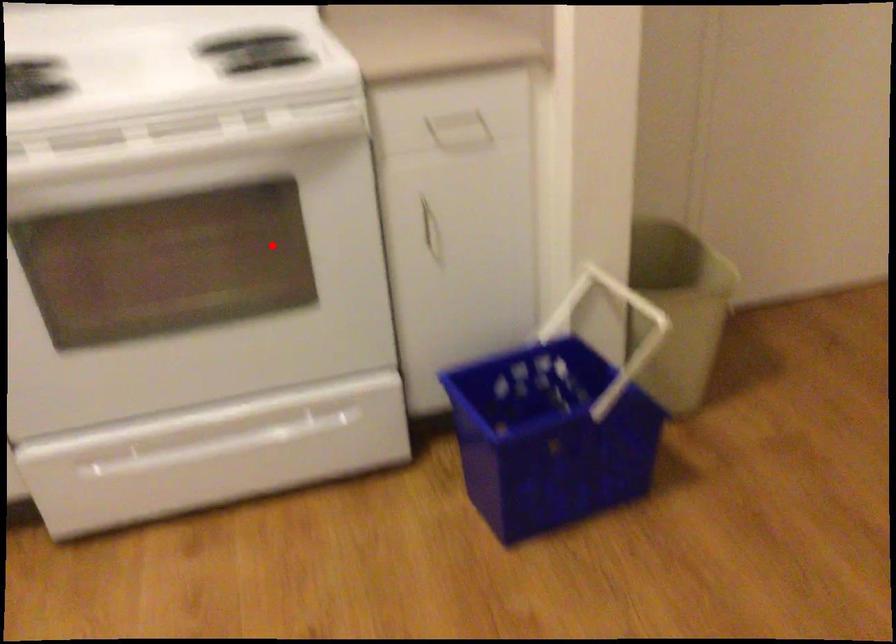
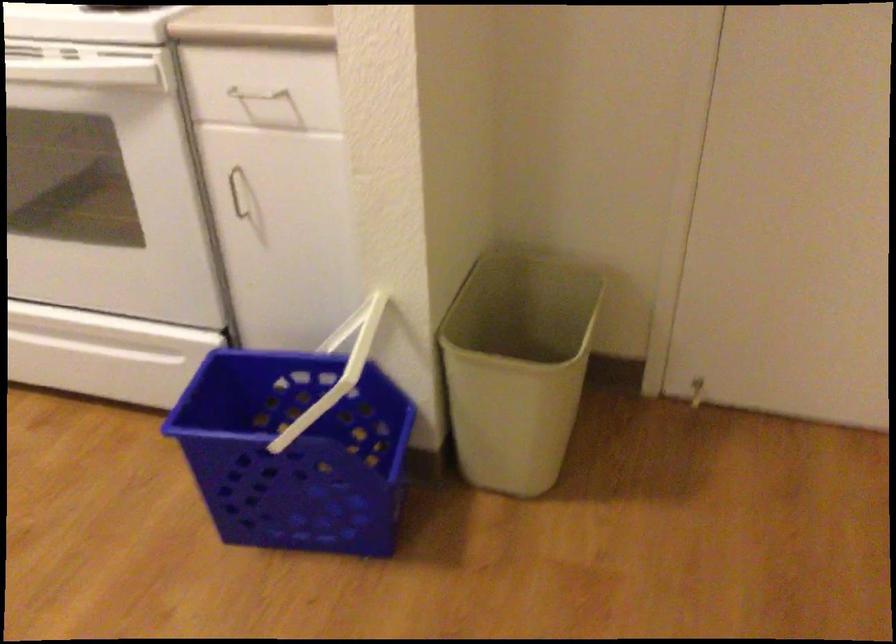
The point at the highlighted location is marked in the first image. Where is the corresponding point in the second image?

(104, 185)